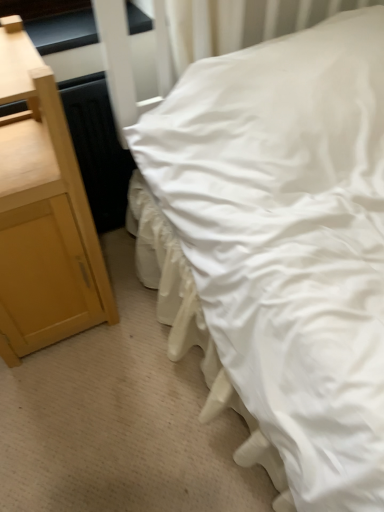
Question: Would you say white smooth bed at center is inside or outside black glossy window sill at upper left?

Choices:
 (A) inside
 (B) outside

Answer: (B)

Question: Visually, is white smooth bed at center positioned to the left or to the right of black glossy window sill at upper left?

Choices:
 (A) right
 (B) left

Answer: (A)

Question: Which of these objects is positioned closest to the white smooth bed at center?

Choices:
 (A) light wood/texture nightstand at left
 (B) black glossy window sill at upper left

Answer: (A)

Question: Which object is positioned closest to the light wood/texture nightstand at left?

Choices:
 (A) black glossy window sill at upper left
 (B) white smooth bed at center

Answer: (B)